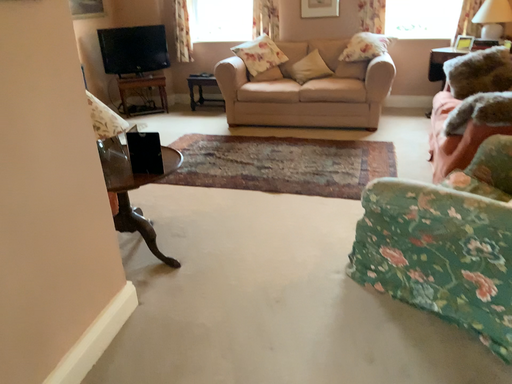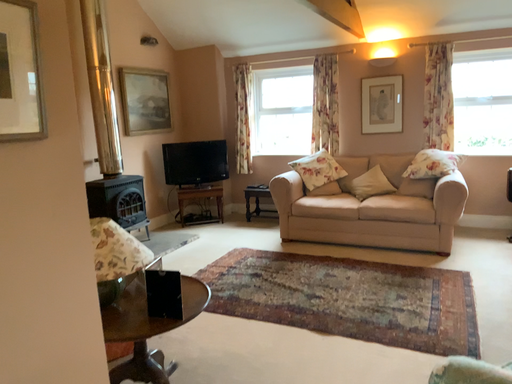
Question: Which way did the camera rotate in the video?

Choices:
 (A) rotated right
 (B) rotated left

Answer: (B)